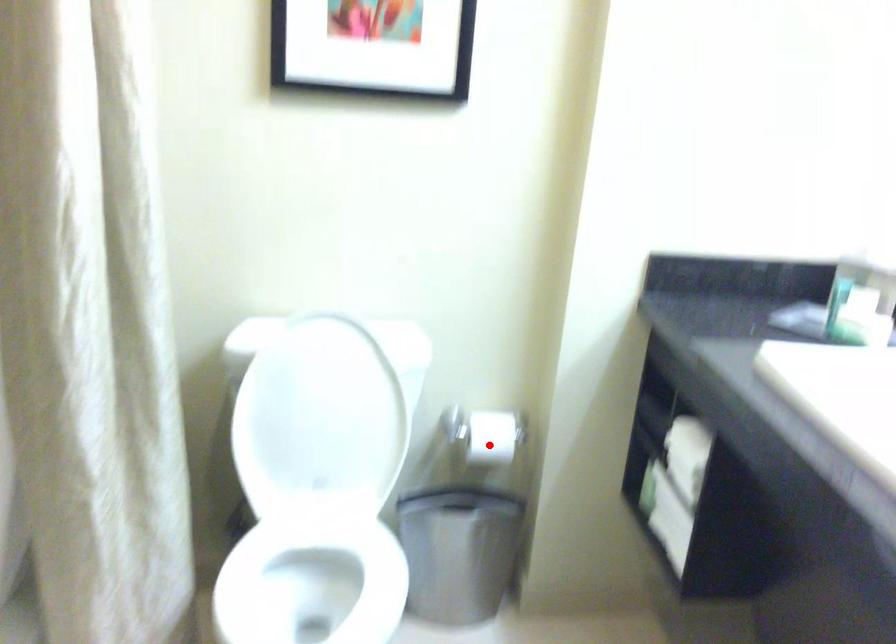
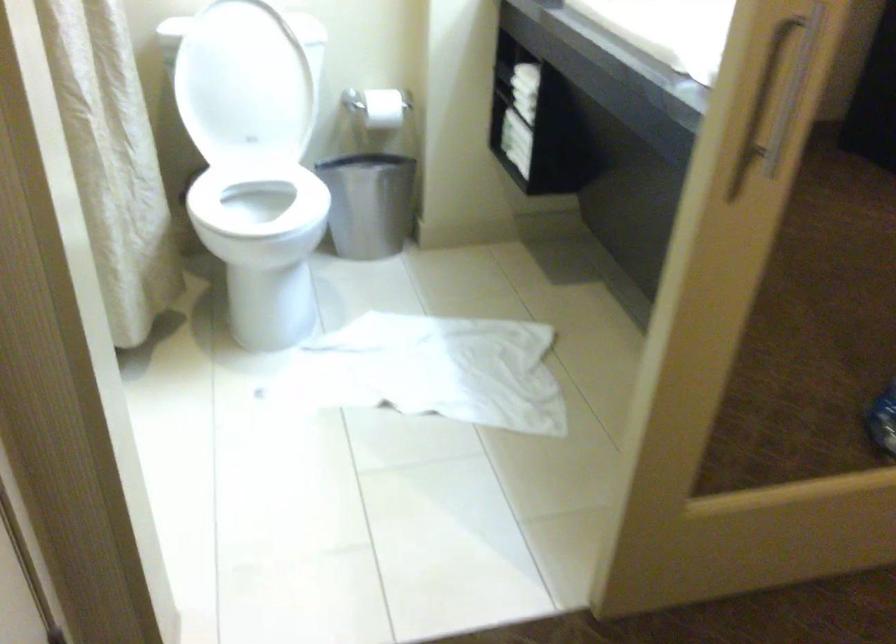
Locate, in the second image, the point that corresponds to the highlighted location in the first image.

(383, 108)